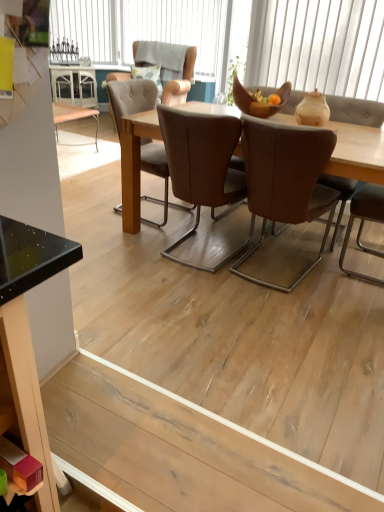
Locate an element on the screen. The image size is (384, 512). matte brown bowl at center is located at coordinates (259, 102).

Find the location of a particular element. The width and height of the screenshot is (384, 512). light brown leather chair at upper center, acting as the 1th chair starting from the top is located at coordinates (181, 80).

Find the location of `brown leather chair at center, placed as the second chair when sorted from back to front`. brown leather chair at center, placed as the second chair when sorted from back to front is located at coordinates (202, 168).

Measure the distance between clear glass wine rack at upper left, acting as the third window starting from the front, and camera.

The depth of clear glass wine rack at upper left, acting as the third window starting from the front, is 18.13 feet.

What is the approximate width of clear glass wine rack at upper left, which is the third window in right-to-left order?

clear glass wine rack at upper left, which is the third window in right-to-left order, is 3.61 inches in width.

Describe the element at coordinates (286, 186) in the screenshot. The width and height of the screenshot is (384, 512). I see `brown leather chair at center, the 1th chair from the front` at that location.

Image resolution: width=384 pixels, height=512 pixels. Identify the location of white textured window at upper center, which is counted as the 1th window, starting from the right. (318, 46).

How many degrees apart are the facing directions of matte black desk at lower left and natural wood table at center?

matte black desk at lower left and natural wood table at center are facing 177 degrees away from each other.

From the image's perspective, is matte black desk at lower left on natural wood table at center?

No.

From a real-world perspective, which object stands above the other?

natural wood table at center is physically above.

Is matte black desk at lower left to the left of natural wood table at center from the viewer's perspective?

Yes, matte black desk at lower left is to the left of natural wood table at center.

Is white textured cushion at upper center, acting as the 2th window starting from the back, to the left or to the right of brown leather chair at center, which ranks as the 2th chair in front-to-back order, in the image?

In the image, white textured cushion at upper center, acting as the 2th window starting from the back, appears on the left side of brown leather chair at center, which ranks as the 2th chair in front-to-back order.

Which of these two, white textured cushion at upper center, the 2th window when ordered from right to left, or brown leather chair at center, which ranks as the 2th chair in front-to-back order, is thinner?

With smaller width is white textured cushion at upper center, the 2th window when ordered from right to left.

Is white textured cushion at upper center, the 2th window viewed from the front, taller than brown leather chair at center, placed as the second chair when sorted from back to front?

No, white textured cushion at upper center, the 2th window viewed from the front, is not taller than brown leather chair at center, placed as the second chair when sorted from back to front.

At what (x,y) coordinates should I click in order to perform the action: click on the 2nd chair in front of the white textured cushion at upper center, acting as the 2th window starting from the back, counting from the anchor's position. Please return your answer as a coordinate pair (x, y). The height and width of the screenshot is (512, 384). Looking at the image, I should click on (202, 168).

Are brown leather chair at center, the 1th chair from the front, and matte black desk at lower left beside each other?

No, brown leather chair at center, the 1th chair from the front, is not next to matte black desk at lower left.

Based on the photo, considering the sizes of brown leather chair at center, the 1th chair from the front, and matte black desk at lower left in the image, is brown leather chair at center, the 1th chair from the front, taller or shorter than matte black desk at lower left?

In the image, brown leather chair at center, the 1th chair from the front, appears to be taller than matte black desk at lower left.

Who is taller, white textured window at upper center, arranged as the third window when viewed from the left, or white textured cushion at upper center, the 2th window positioned from the left?

Standing taller between the two is white textured cushion at upper center, the 2th window positioned from the left.

Which object is closer to the camera, white textured window at upper center, which is the third window from back to front, or white textured cushion at upper center, the 2th window viewed from the front?

white textured window at upper center, which is the third window from back to front.

From the picture: Is white textured window at upper center, the 1th window when ordered from front to back, to the left of white textured cushion at upper center, acting as the 2th window starting from the back, from the viewer's perspective?

In fact, white textured window at upper center, the 1th window when ordered from front to back, is to the right of white textured cushion at upper center, acting as the 2th window starting from the back.

Is white textured window at upper center, which is the 1th window in bottom-to-top order, far away from white textured cushion at upper center, the 2th window viewed from the front?

Absolutely, white textured window at upper center, which is the 1th window in bottom-to-top order, is distant from white textured cushion at upper center, the 2th window viewed from the front.

Which of these two, white textured cushion at upper center, the 2th window viewed from the front, or matte black desk at lower left, is thinner?

With smaller width is white textured cushion at upper center, the 2th window viewed from the front.

Image resolution: width=384 pixels, height=512 pixels. What are the coordinates of `the 1st window to the right when counting from the matte black desk at lower left` in the screenshot? It's located at (138, 28).

Is white textured cushion at upper center, acting as the 2th window starting from the back, to the right of matte black desk at lower left from the viewer's perspective?

Yes.

Is white textured cushion at upper center, the 2th window positioned from the left, positioned far away from matte black desk at lower left?

white textured cushion at upper center, the 2th window positioned from the left, is positioned a significant distance from matte black desk at lower left.

From the image's perspective, is white textured cushion at upper center, acting as the 2th window starting from the back, located above or below natural wood table at center?

Based on their image positions, white textured cushion at upper center, acting as the 2th window starting from the back, is located above natural wood table at center.

Is white textured cushion at upper center, acting as the 2th window starting from the back, oriented towards natural wood table at center?

No.

Is white textured cushion at upper center, the 2th window when ordered from right to left, inside or outside of natural wood table at center?

white textured cushion at upper center, the 2th window when ordered from right to left, cannot be found inside natural wood table at center.

Does point (70, 10) lie behind point (341, 172)?

That is True.

From a real-world perspective, is brown leather chair at center, arranged as the first chair when ordered from the bottom, positioned above or below natural wood table at center?

In terms of real-world spatial position, brown leather chair at center, arranged as the first chair when ordered from the bottom, is above natural wood table at center.

Which object is closer to the camera taking this photo, brown leather chair at center, the 1th chair from the front, or natural wood table at center?

Positioned in front is brown leather chair at center, the 1th chair from the front.

Is brown leather chair at center, arranged as the first chair when ordered from the bottom, positioned with its back to natural wood table at center?

Correct, brown leather chair at center, arranged as the first chair when ordered from the bottom, is looking away from natural wood table at center.

Based on the photo, which of these two, brown leather chair at center, the 1th chair from the front, or natural wood table at center, is wider?

natural wood table at center.

In the image, there is a natural wood table at center. Where is `desk below it (from the image's perspective)`? desk below it (from the image's perspective) is located at coordinates pyautogui.click(x=29, y=332).

Which window is the 1st one when counting from the left side of the brown leather chair at center, placed as the second chair when sorted from back to front? Please provide its 2D coordinates.

[(138, 28)]

From the image, which object appears to be nearer to natural wood floor at lower center, brown leather chair at center, placed as the second chair when sorted from back to front, or white textured cushion at upper center, the 2th window when ordered from right to left?

Based on the image, brown leather chair at center, placed as the second chair when sorted from back to front, appears to be nearer to natural wood floor at lower center.

Looking at the image, which one is located closer to white textured window at upper center, the 3th window when ordered from top to bottom, white textured cushion at upper center, the second window ordered from the bottom, or natural wood floor at lower center?

natural wood floor at lower center lies closer to white textured window at upper center, the 3th window when ordered from top to bottom, than the other object.

When comparing their distances from matte brown bowl at center, does light brown leather chair at upper center, acting as the 1th chair starting from the top, or clear glass wine rack at upper left, which is the third window in right-to-left order, seem closer?

Based on the image, light brown leather chair at upper center, acting as the 1th chair starting from the top, appears to be nearer to matte brown bowl at center.

Based on their spatial positions, is brown leather chair at center, arranged as the first chair when ordered from the bottom, or white textured window at upper center, which is the 1th window in bottom-to-top order, closer to natural wood floor at lower center?

brown leather chair at center, arranged as the first chair when ordered from the bottom, is positioned closer to the anchor natural wood floor at lower center.

From the image, which object appears to be farther from fluffy fabric pillow at upper center, matte brown bowl at center or light brown leather chair at upper center, acting as the 1th chair starting from the top?

Based on the image, matte brown bowl at center appears to be further to fluffy fabric pillow at upper center.

Consider the image. From the image, which object appears to be farther from natural wood floor at lower center, matte black desk at lower left or natural wood table at center?

natural wood table at center is further to natural wood floor at lower center.

Which object lies nearer to the anchor point natural wood floor at lower center, white textured window at upper center, which is the third window from back to front, or matte black desk at lower left?

Based on the image, matte black desk at lower left appears to be nearer to natural wood floor at lower center.

When comparing their distances from matte black desk at lower left, does matte brown bowl at center or natural wood table at center seem further?

Based on the image, matte brown bowl at center appears to be further to matte black desk at lower left.

I want to click on pillow between brown leather chair at center, placed as the second chair when sorted from back to front, and clear glass wine rack at upper left, which is the third window in right-to-left order, along the z-axis, so click(x=149, y=76).

The width and height of the screenshot is (384, 512). I want to click on kitchen & dining room table that lies between white textured window at upper center, the 1th window when ordered from front to back, and brown leather chair at center, the third chair from the top, from top to bottom, so click(x=357, y=152).

Where is `kitchen & dining room table between white textured window at upper center, which is the third window from back to front, and matte black desk at lower left from top to bottom`? This screenshot has height=512, width=384. kitchen & dining room table between white textured window at upper center, which is the third window from back to front, and matte black desk at lower left from top to bottom is located at coordinates (357, 152).

At what (x,y) coordinates should I click in order to perform the action: click on kitchen & dining room table between matte black desk at lower left and brown leather chair at center, arranged as the first chair when ordered from the bottom. Please return your answer as a coordinate pair (x, y). The image size is (384, 512). Looking at the image, I should click on (357, 152).